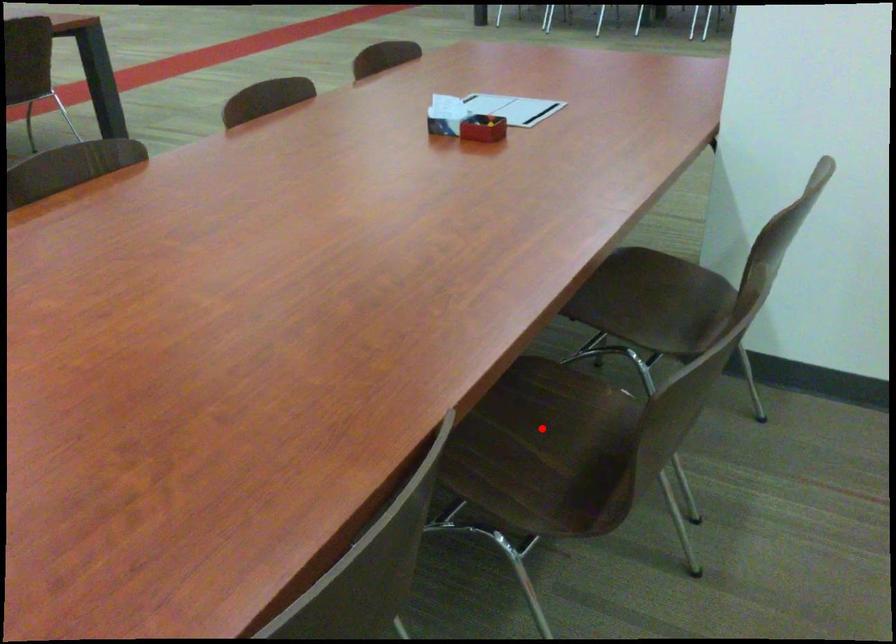
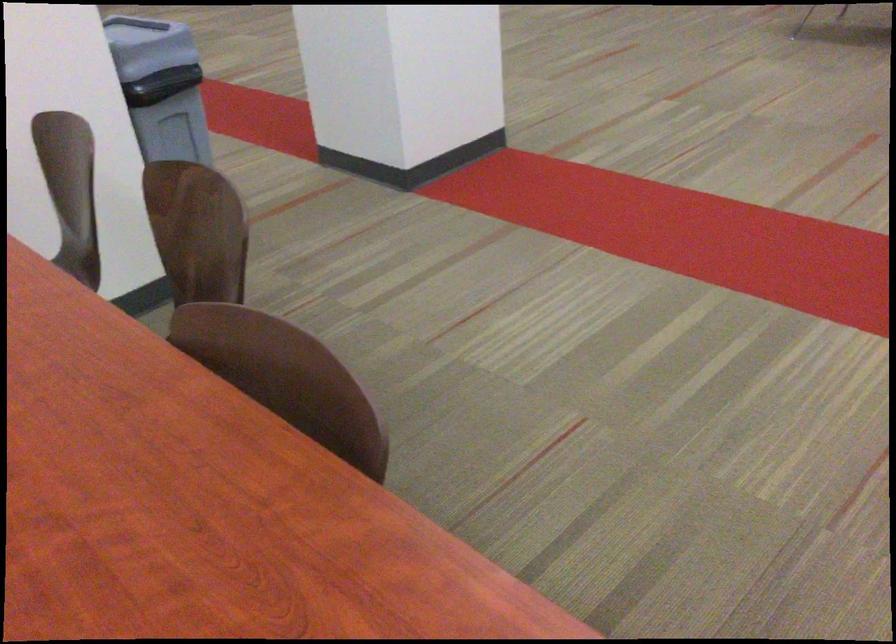
Question: I am providing you with two images of the same scene from different viewpoints. A red point is marked on the first image. Is the red point's position out of view in image 2?

Choices:
 (A) Yes
 (B) No

Answer: (A)